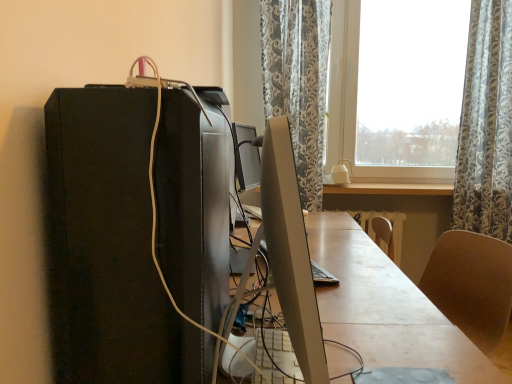
Where is `smooth wooden desk at center`? The image size is (512, 384). smooth wooden desk at center is located at coordinates (386, 307).

Locate an element on the screen. patterned fabric curtain at upper right is located at coordinates (486, 125).

What do you see at coordinates (390, 189) in the screenshot?
I see `light wood table at center` at bounding box center [390, 189].

At what (x,y) coordinates should I click in order to perform the action: click on smooth wooden desk at center. Please return your answer as a coordinate pair (x, y). This screenshot has height=384, width=512. Looking at the image, I should click on (386, 307).

Can you confirm if light wood table at center is shorter than satin silver monitor at center?

Correct, light wood table at center is not as tall as satin silver monitor at center.

Is light wood table at center in front of satin silver monitor at center?

No, light wood table at center is further to the viewer.

Which is correct: light wood table at center is inside satin silver monitor at center, or outside of it?

light wood table at center is located beyond the bounds of satin silver monitor at center.

Which of these two, patterned fabric curtain at upper right or light wood table at center, stands shorter?

light wood table at center.

Looking at this image, from a real-world perspective, who is located lower, patterned fabric curtain at upper right or light wood table at center?

light wood table at center.

Is light wood table at center at the back of patterned fabric curtain at upper right?

That's not correct — patterned fabric curtain at upper right is not looking away from light wood table at center.

From the image's perspective, is patterned fabric curtain at upper right above or below light wood table at center?

Clearly, from the image's perspective, patterned fabric curtain at upper right is above light wood table at center.

Considering the relative positions of satin silver monitor at center and black matte computer tower at left in the image provided, is satin silver monitor at center to the right of black matte computer tower at left from the viewer's perspective?

Indeed, satin silver monitor at center is positioned on the right side of black matte computer tower at left.

Is satin silver monitor at center aimed at black matte computer tower at left?

Yes, satin silver monitor at center faces towards black matte computer tower at left.

Is the position of satin silver monitor at center less distant than that of black matte computer tower at left?

Yes, satin silver monitor at center is in front of black matte computer tower at left.

What's the angular difference between satin silver monitor at center and black matte computer tower at left's facing directions?

1.14 degrees.

Considering the points (257, 140) and (482, 158), which point is in front, point (257, 140) or point (482, 158)?

Positioned in front is point (257, 140).

From a real-world perspective, does satin silver monitor at center stand above patterned fabric curtain at upper right?

Incorrect, from a real-world perspective, satin silver monitor at center is lower than patterned fabric curtain at upper right.

Are satin silver monitor at center and patterned fabric curtain at upper right making contact?

No, satin silver monitor at center is not making contact with patterned fabric curtain at upper right.

Are smooth wooden desk at center and black matte computer tower at left making contact?

They are not placed beside each other.

Considering the relative positions of smooth wooden desk at center and black matte computer tower at left in the image provided, is smooth wooden desk at center to the left of black matte computer tower at left from the viewer's perspective?

No, smooth wooden desk at center is not to the left of black matte computer tower at left.

Is smooth wooden desk at center positioned with its back to black matte computer tower at left?

No, smooth wooden desk at center is not facing the opposite direction of black matte computer tower at left.

Does point (362, 342) come behind point (93, 164)?

Yes, point (362, 342) is farther from viewer.

Between smooth wooden desk at center and satin silver monitor at center, which one is positioned in front?

satin silver monitor at center is more forward.

Could you tell me if smooth wooden desk at center is turned towards satin silver monitor at center?

No, smooth wooden desk at center is not turned towards satin silver monitor at center.

From the image's perspective, is smooth wooden desk at center below satin silver monitor at center?

Yes.

Is smooth wooden desk at center smaller than satin silver monitor at center?

Incorrect, smooth wooden desk at center is not smaller in size than satin silver monitor at center.

Consider the image. Which of these two, light wood table at center or smooth wooden desk at center, stands taller?

With more height is smooth wooden desk at center.

From the image's perspective, is light wood table at center above smooth wooden desk at center?

Indeed, from the image's perspective, light wood table at center is shown above smooth wooden desk at center.

Between light wood table at center and smooth wooden desk at center, which one has smaller size?

Smaller between the two is light wood table at center.

Identify the location of computer monitor lying below the light wood table at center (from the image's perspective). (290, 250).

Identify the location of curtain above the light wood table at center (from a real-world perspective). (486, 125).

In the scene shown: Considering their positions, is light wood table at center positioned closer to black matte computer tower at left than satin silver monitor at center?

satin silver monitor at center.

Considering their positions, is smooth wooden desk at center positioned further to satin silver monitor at center than patterned fabric curtain at upper right?

patterned fabric curtain at upper right is further to satin silver monitor at center.

From the image, which object appears to be farther from light wood table at center, satin silver monitor at center or patterned fabric curtain at upper right?

Among the two, satin silver monitor at center is located further to light wood table at center.

Estimate the real-world distances between objects in this image. Which object is closer to light wood table at center, satin silver monitor at center or black matte computer tower at left?

satin silver monitor at center is positioned closer to the anchor light wood table at center.

Based on the photo, based on their spatial positions, is patterned fabric curtain at upper right or black matte computer tower at left further from satin silver monitor at center?

patterned fabric curtain at upper right lies further to satin silver monitor at center than the other object.

Based on their spatial positions, is light wood table at center or black matte computer tower at left further from smooth wooden desk at center?

Among the two, light wood table at center is located further to smooth wooden desk at center.

Considering their positions, is black matte computer tower at left positioned closer to satin silver monitor at center than light wood table at center?

black matte computer tower at left is closer to satin silver monitor at center.

When comparing their distances from satin silver monitor at center, does patterned fabric curtain at upper right or smooth wooden desk at center seem further?

patterned fabric curtain at upper right.

Image resolution: width=512 pixels, height=384 pixels. Identify the location of computer tower between satin silver monitor at center and patterned fabric curtain at upper right in the front-back direction. (110, 246).

This screenshot has height=384, width=512. What are the coordinates of `computer monitor between black matte computer tower at left and smooth wooden desk at center in the vertical direction` in the screenshot? It's located at (290, 250).

I want to click on desk located between satin silver monitor at center and light wood table at center in the depth direction, so point(386,307).

I want to click on curtain between smooth wooden desk at center and light wood table at center in the front-back direction, so click(x=486, y=125).